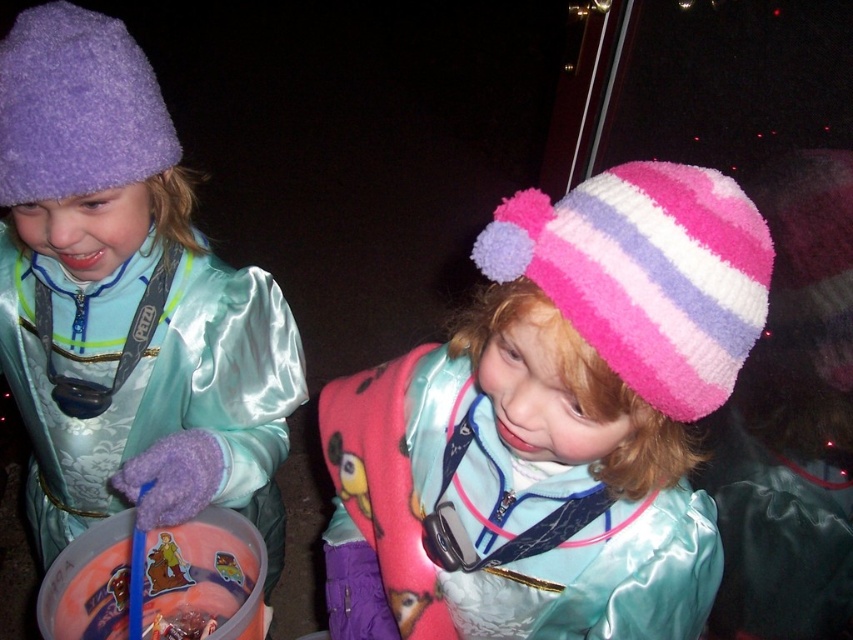
You are a photographer taking a picture of the two children. You want to ensure both the matte purple hat at left and the pink striped knit hat at upper right are clearly visible in the frame. Based on their positions, which hat is lower in the image?

The matte purple hat at left is located below the pink striped knit hat at upper right, so the matte purple hat at left is lower in the image.

Looking at this image, you are a photographer trying to capture both the pink fuzzy hat at center and the pink striped knit hat at upper right in a single frame. Based on their sizes, which hat will appear larger in the photo?

The pink fuzzy hat at center will appear larger in the photo because it is much taller than the pink striped knit hat at upper right.